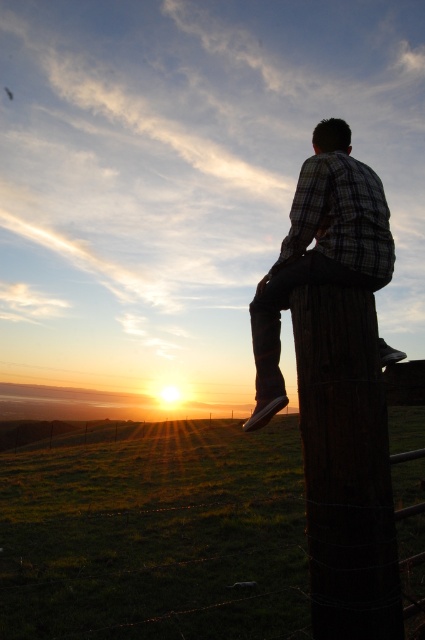
You are standing in the middle of the field and see both the wooden post at center and the plaid shirt at center. Which object is closer to your right side?

The plaid shirt at center is closer to your right side because the wooden post at center is to the left of it.

You are a farmer checking the fence posts in your field. You notice two posts, the wooden post at center and the dark brown wooden post at right. Which one is taller?

The wooden post at center is much taller than the dark brown wooden post at right.